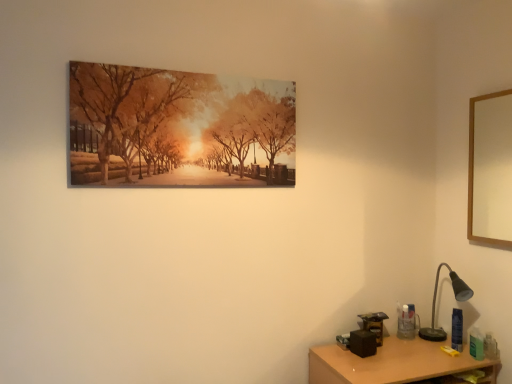
Question: From a real-world perspective, relative to wooden desk at lower right, is wooden picture frame at upper right, the first picture frame viewed from the right, vertically above or below?

Choices:
 (A) above
 (B) below

Answer: (A)

Question: In terms of size, does wooden picture frame at upper right, the second picture frame from the left, appear bigger or smaller than wooden desk at lower right?

Choices:
 (A) big
 (B) small

Answer: (B)

Question: Which object is the farthest from the wooden desk at lower right?

Choices:
 (A) matte canvas print at upper center, the second picture frame viewed from the right
 (B) black metal table lamp at lower right
 (C) wooden picture frame at upper right, the first picture frame viewed from the right

Answer: (A)

Question: Which object is positioned farthest from the black metal table lamp at lower right?

Choices:
 (A) matte canvas print at upper center, the second picture frame viewed from the right
 (B) wooden desk at lower right
 (C) wooden picture frame at upper right, the first picture frame viewed from the right

Answer: (A)